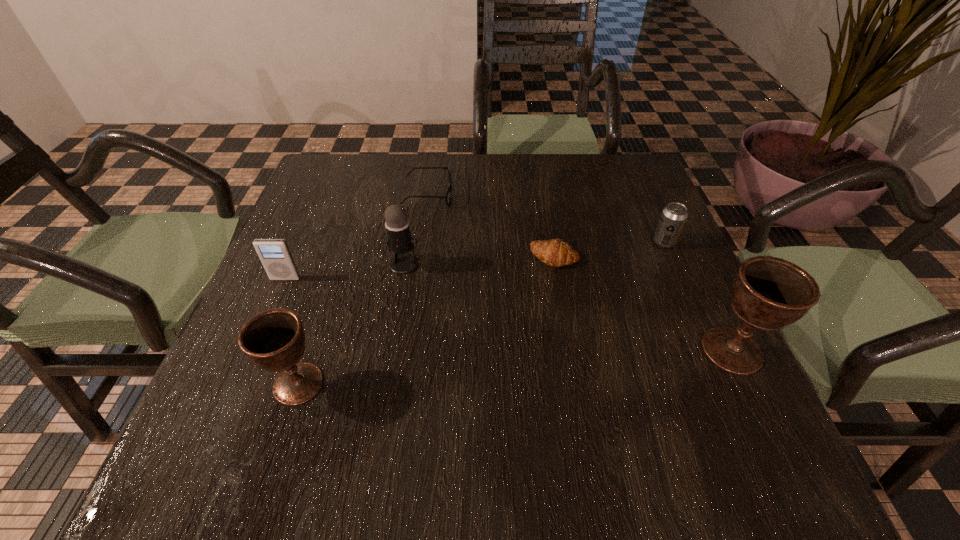
The image size is (960, 540). In order to click on free space located on the back of the taller chalice in this screenshot , I will do `click(699, 281)`.

Where is `vacant point located 0.190m on the left of the microphone`? vacant point located 0.190m on the left of the microphone is located at coordinates (303, 264).

Where is `free location located 0.200m on the front-facing side of the spectacles`? free location located 0.200m on the front-facing side of the spectacles is located at coordinates (529, 194).

Locate an element on the screen. vacant region located 0.340m on the left of the fifth object from left to right is located at coordinates (379, 256).

Where is `free region located 0.250m on the front of the beer can`? free region located 0.250m on the front of the beer can is located at coordinates (x=707, y=339).

Locate an element on the screen. This screenshot has width=960, height=540. vacant space located on the front-facing side of the iPod is located at coordinates (265, 326).

Identify the location of object that is at the far edge. (447, 197).

This screenshot has height=540, width=960. I want to click on chalice that is at the left edge, so click(274, 340).

You are a GUI agent. You are given a task and a screenshot of the screen. Output one action in this format:
    pyautogui.click(x=<x>, y=<y>)
    Task: Click on the iPod positioned at the left edge
    This screenshot has width=960, height=540.
    Given the screenshot: What is the action you would take?
    pyautogui.click(x=274, y=254)

This screenshot has width=960, height=540. I want to click on chalice that is at the right edge, so click(x=768, y=293).